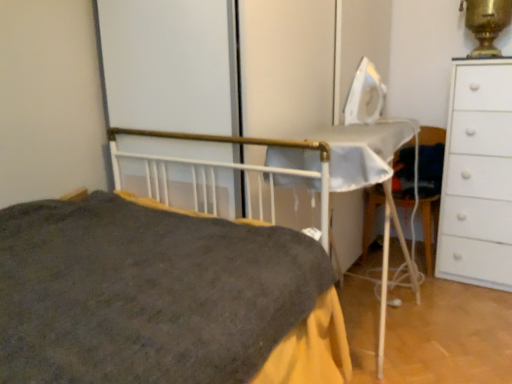
Where is `free point in front of white fabric chair at right`? Image resolution: width=512 pixels, height=384 pixels. free point in front of white fabric chair at right is located at coordinates (425, 289).